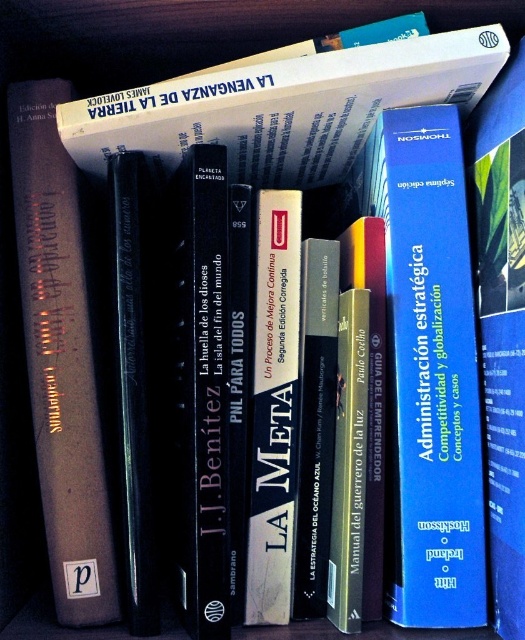
What do you see at coordinates (427, 369) in the screenshot? The image size is (525, 640). I see `blue hardcover book at center` at bounding box center [427, 369].

Does point (396, 248) come in front of point (96, 612)?

No, it is not.

Measure the distance between point (446, 534) and camera.

25.45 inches

The image size is (525, 640). In order to click on blue hardcover book at center in this screenshot , I will do `click(427, 369)`.